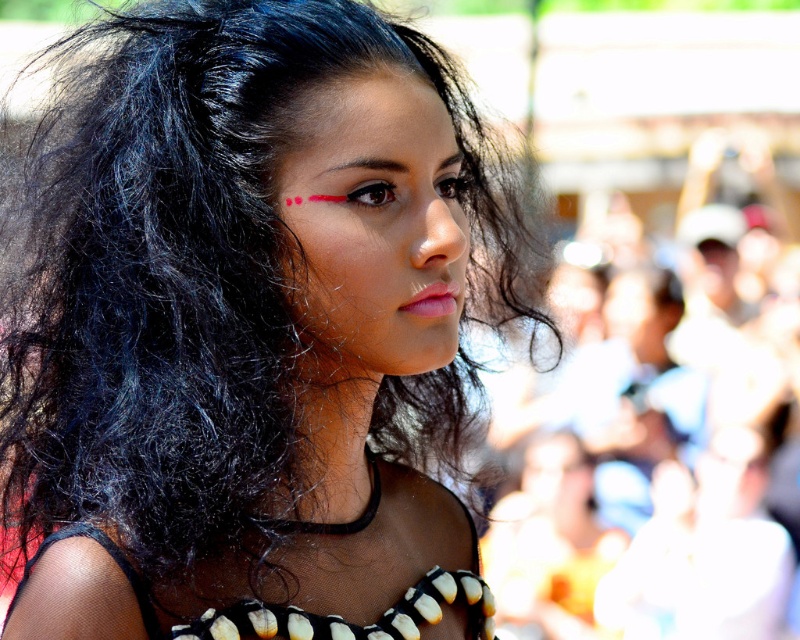
In the scene shown: You are a photographer trying to focus on the matte black hair at center and the blurred white crowd at right in the image. Which object is smaller in the frame?

The matte black hair at center is smaller compared to the blurred white crowd at right.

You are a photographer trying to capture the subject with their hair and the crowd in the background. Based on the scene, can you tell me whether the matte black hair at center is positioned higher or lower than the blurred white crowd at right?

The matte black hair at center is located above the blurred white crowd at right, meaning it is positioned higher than the crowd.

In the scene shown: You are a photographer adjusting your camera settings. You notice the matte black hair at center and the blurred white crowd at right in your viewfinder. Which object would appear narrower when looking through the lens?

The matte black hair at center appears narrower than the blurred white crowd at right because it is thinner.